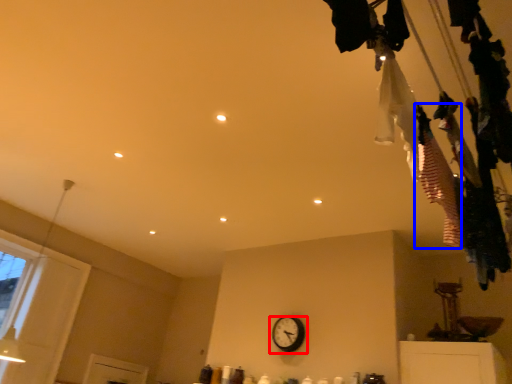
Question: Which point is further to the camera, wall clock (highlighted by a red box) or clothing (highlighted by a blue box)?

Choices:
 (A) wall clock
 (B) clothing

Answer: (A)